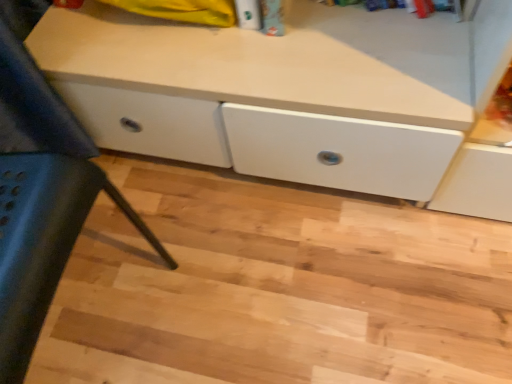
In order to click on free point above natural wood stair at center (from a real-world perspective) in this screenshot , I will do `click(258, 268)`.